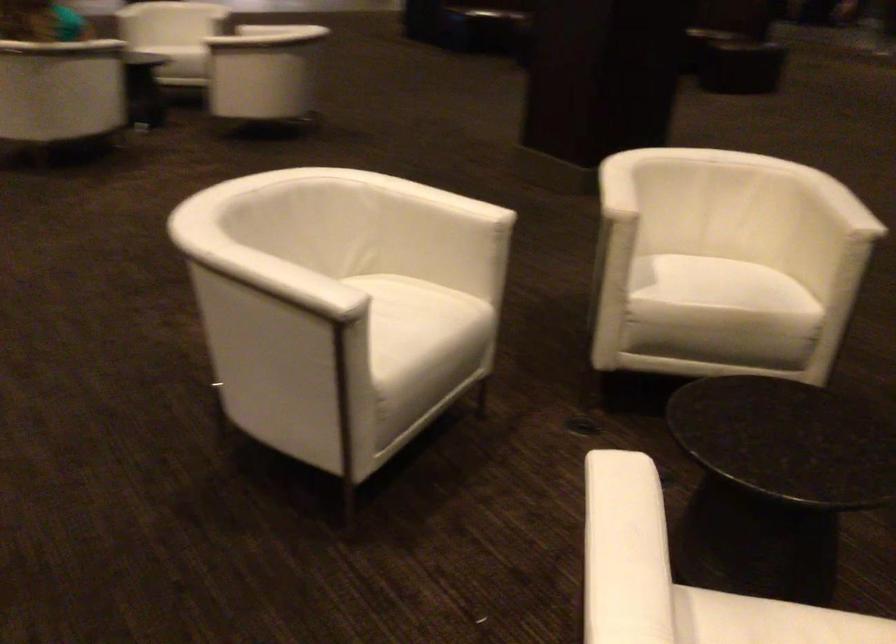
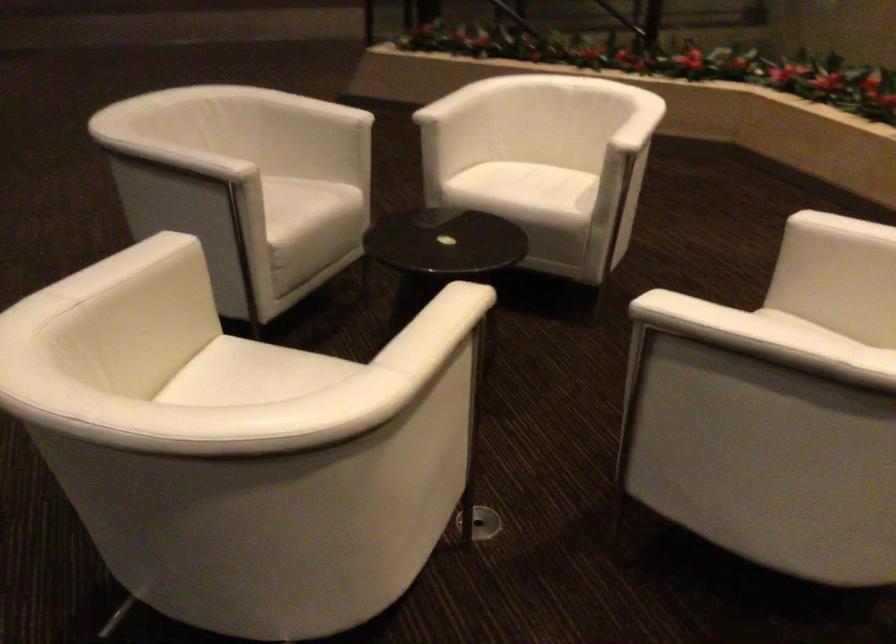
Where in the second image is the point corresponding to pixel 631 189 from the first image?

(437, 308)